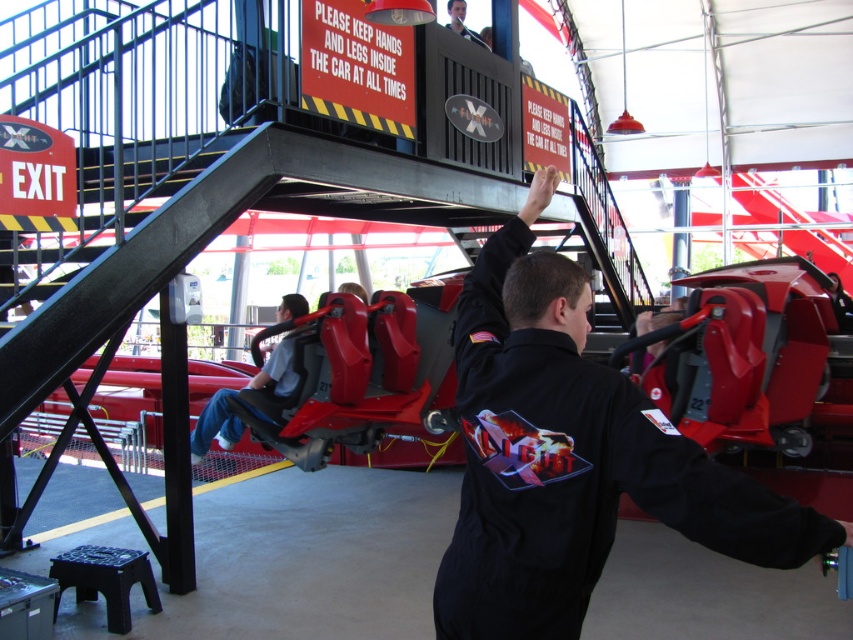
Question: Among these points, which one is nearest to the camera?

Choices:
 (A) (463, 33)
 (B) (474, 381)

Answer: (B)

Question: Which object is positioned farthest from the black matte uniform at center?

Choices:
 (A) gray fabric seat at lower center
 (B) smooth black shirt at center

Answer: (B)

Question: Which of the following is the closest to the observer?

Choices:
 (A) (286, 392)
 (B) (456, 10)
 (C) (527, 548)

Answer: (C)

Question: Is gray fabric seat at lower center smaller than smooth black shirt at center?

Choices:
 (A) no
 (B) yes

Answer: (A)

Question: Can you confirm if gray fabric seat at lower center is wider than smooth black shirt at center?

Choices:
 (A) no
 (B) yes

Answer: (B)

Question: Is black matte uniform at center wider than gray fabric seat at lower center?

Choices:
 (A) yes
 (B) no

Answer: (B)